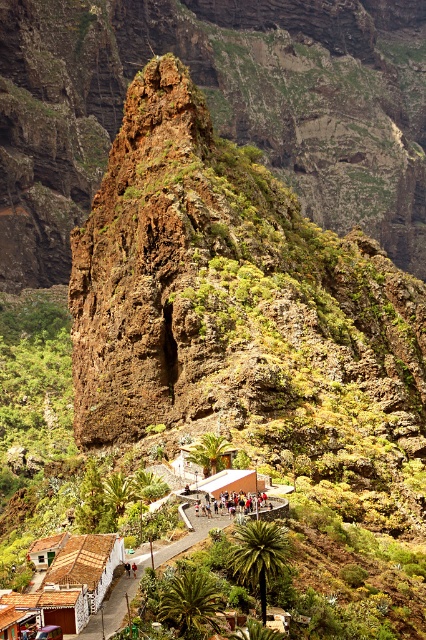
Which is above, brown tiled roofs at lower center or wooden hut at center?

wooden hut at center

Between point (74, 556) and point (258, 476), which one is positioned behind?

Point (258, 476)

Where is `brown tiled roofs at lower center`? This screenshot has height=640, width=426. brown tiled roofs at lower center is located at coordinates (72, 561).

Which is below, brown tiled roofs at lower center or multicolored clothing at center?

brown tiled roofs at lower center is lower down.

Looking at this image, does brown tiled roofs at lower center have a lesser width compared to multicolored clothing at center?

In fact, brown tiled roofs at lower center might be wider than multicolored clothing at center.

This screenshot has height=640, width=426. In order to click on brown tiled roofs at lower center in this screenshot , I will do `click(72, 561)`.

The height and width of the screenshot is (640, 426). What do you see at coordinates (72, 561) in the screenshot? I see `brown tiled roofs at lower center` at bounding box center [72, 561].

Is brown tiled roofs at lower center taller than brown thatched roof hut at lower left?

Indeed, brown tiled roofs at lower center has a greater height compared to brown thatched roof hut at lower left.

Who is more forward, (81, 580) or (69, 572)?

Point (81, 580)

You are a GUI agent. You are given a task and a screenshot of the screen. Output one action in this format:
    pyautogui.click(x=<x>, y=<y>)
    Task: Click on the brown tiled roofs at lower center
    This screenshot has height=640, width=426.
    Given the screenshot: What is the action you would take?
    pyautogui.click(x=72, y=561)